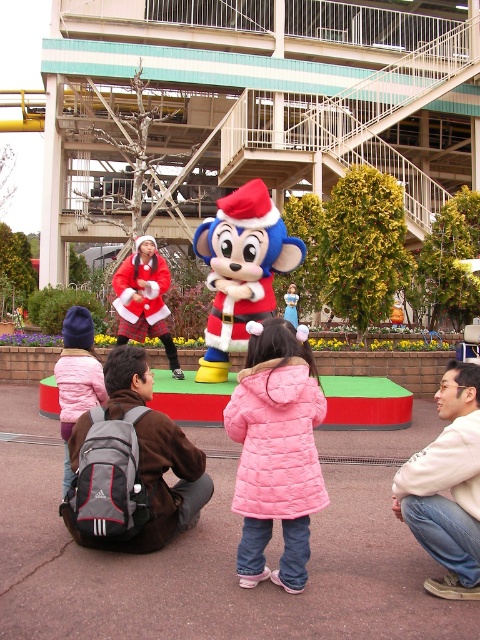
Question: Which object appears closest to the camera in this image?

Choices:
 (A) pink quilted coat at center
 (B) gray fabric backpack at lower left
 (C) light beige sweater at lower right

Answer: (A)

Question: Does light beige sweater at lower right have a larger size compared to matte pink coat at lower left?

Choices:
 (A) yes
 (B) no

Answer: (B)

Question: Among these objects, which one is nearest to the camera?

Choices:
 (A) light beige sweater at lower right
 (B) gray fabric backpack at lower left
 (C) matte pink coat at lower left
 (D) pink quilted coat at center

Answer: (D)

Question: Can you confirm if gray fabric backpack at lower left is positioned above velvet plush monkey at center?

Choices:
 (A) no
 (B) yes

Answer: (A)

Question: Does pink quilted coat at center have a lesser width compared to matte pink coat at lower left?

Choices:
 (A) no
 (B) yes

Answer: (B)

Question: Which object is farther from the camera taking this photo?

Choices:
 (A) matte pink coat at lower left
 (B) gray fabric backpack at lower left

Answer: (A)